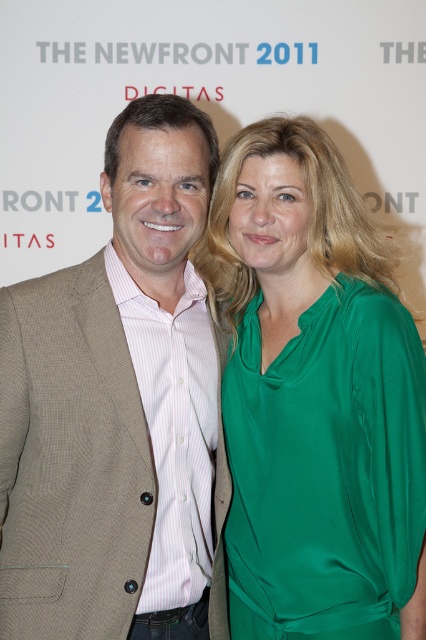
Question: Does green satin blouse at center come behind brown textured blazer at left?

Choices:
 (A) yes
 (B) no

Answer: (B)

Question: Can you confirm if green satin blouse at center is positioned to the left of brown textured blazer at left?

Choices:
 (A) no
 (B) yes

Answer: (A)

Question: Which point is farther from the camera taking this photo?

Choices:
 (A) (253, 150)
 (B) (178, 328)

Answer: (B)

Question: Among these objects, which one is farthest from the camera?

Choices:
 (A) brown textured blazer at left
 (B) green satin blouse at center

Answer: (A)

Question: Which of the following is the closest to the observer?

Choices:
 (A) (169, 269)
 (B) (291, 157)

Answer: (B)

Question: Can you confirm if green satin blouse at center is positioned below brown textured blazer at left?

Choices:
 (A) yes
 (B) no

Answer: (A)